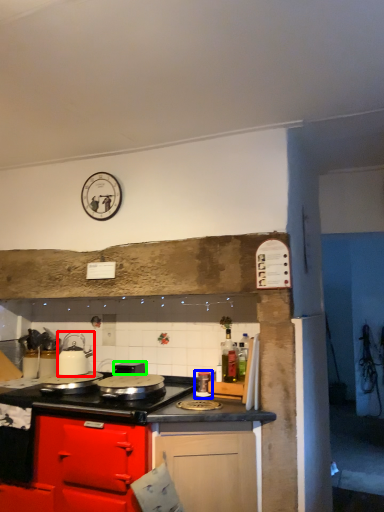
Question: Which is nearer to the kitchen appliance (highlighted by a red box)? kitchen appliance (highlighted by a blue box) or appliance (highlighted by a green box).

Choices:
 (A) kitchen appliance
 (B) appliance

Answer: (B)